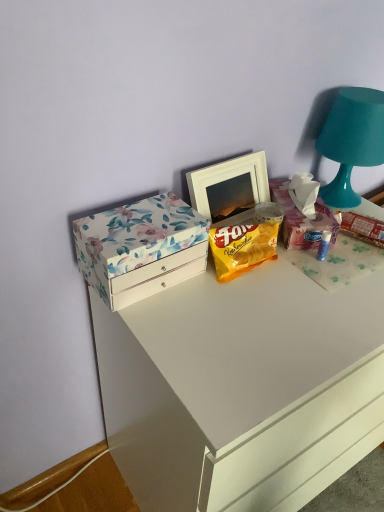
I want to click on free space in front of floral paper box at left, so click(x=176, y=332).